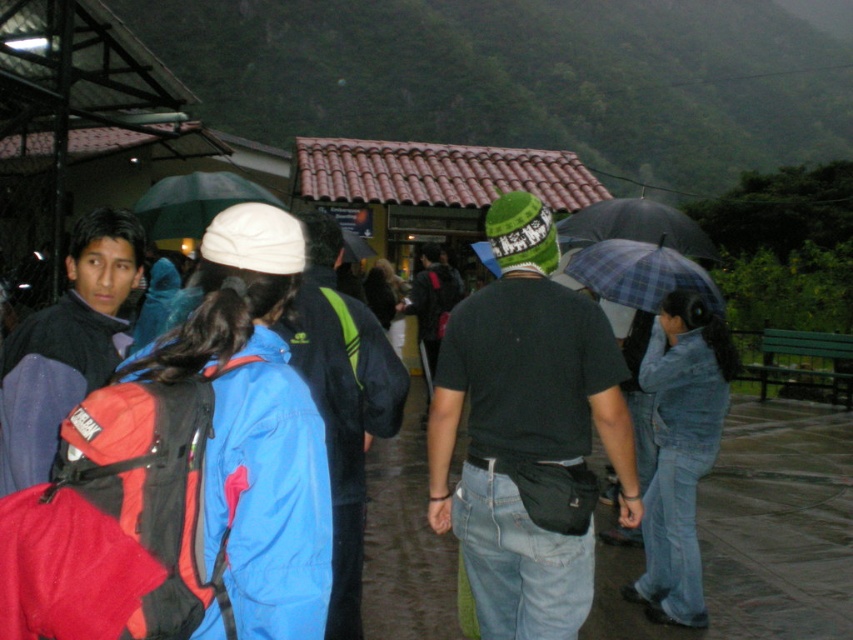
Between plaid fabric umbrella at right and plaid fabric umbrella at center, which one is positioned lower?

plaid fabric umbrella at right is below.

Is plaid fabric umbrella at right bigger than plaid fabric umbrella at center?

No.

The width and height of the screenshot is (853, 640). What do you see at coordinates (639, 273) in the screenshot?
I see `plaid fabric umbrella at right` at bounding box center [639, 273].

Identify the location of plaid fabric umbrella at right. The image size is (853, 640). (639, 273).

Can you confirm if green matte umbrella at upper center is positioned below plaid fabric umbrella at center?

Yes.

Can you confirm if green matte umbrella at upper center is shorter than plaid fabric umbrella at center?

Yes, green matte umbrella at upper center is shorter than plaid fabric umbrella at center.

Locate an element on the screen. green matte umbrella at upper center is located at coordinates (194, 202).

Who is positioned more to the right, green matte umbrella at upper center or transparent plastic umbrella at center?

From the viewer's perspective, transparent plastic umbrella at center appears more on the right side.

Is green matte umbrella at upper center positioned at the back of transparent plastic umbrella at center?

That is False.

In order to click on green matte umbrella at upper center in this screenshot , I will do `click(194, 202)`.

At what (x,y) coordinates should I click in order to perform the action: click on green matte umbrella at upper center. Please return your answer as a coordinate pair (x, y). This screenshot has width=853, height=640. Looking at the image, I should click on (194, 202).